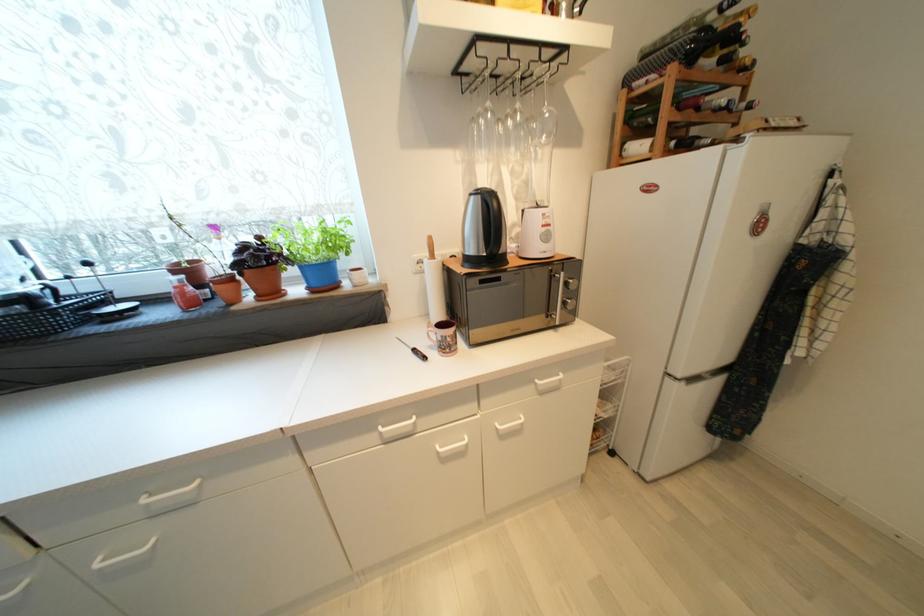
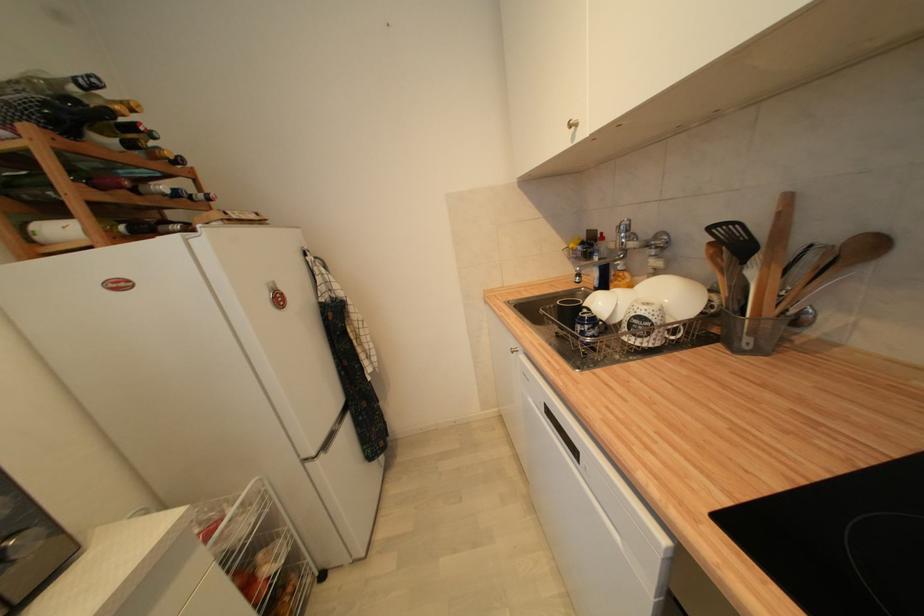
In the second image, find the point that corresponds to [755,108] in the first image.

(213, 200)